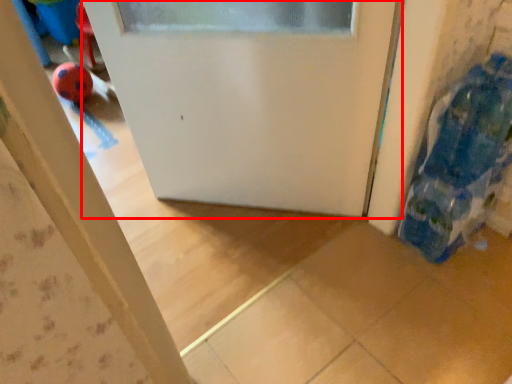
Question: From the image's perspective, what is the correct spatial relationship of door (annotated by the red box) in relation to toy?

Choices:
 (A) below
 (B) above

Answer: (B)